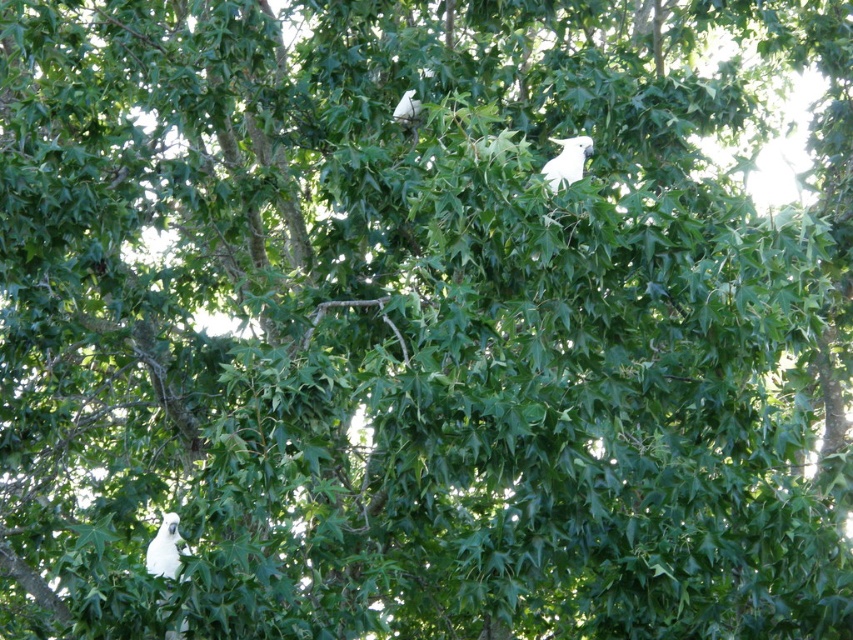
Consider the image. Is white feathered bird at lower left closer to camera compared to white feathered bird at upper center?

Yes, it is.

Locate an element on the screen. white feathered bird at lower left is located at coordinates (165, 547).

The height and width of the screenshot is (640, 853). What do you see at coordinates (567, 161) in the screenshot? I see `white feathered bird at upper right` at bounding box center [567, 161].

Where is `white feathered bird at upper right`? white feathered bird at upper right is located at coordinates (567, 161).

Identify the location of white feathered bird at upper right. This screenshot has width=853, height=640. (567, 161).

Identify the location of white feathered bird at upper right. (567, 161).

Can you confirm if white feathered bird at lower left is wider than white feathered bird at upper right?

Indeed, white feathered bird at lower left has a greater width compared to white feathered bird at upper right.

Identify the location of white feathered bird at lower left. The height and width of the screenshot is (640, 853). (165, 547).